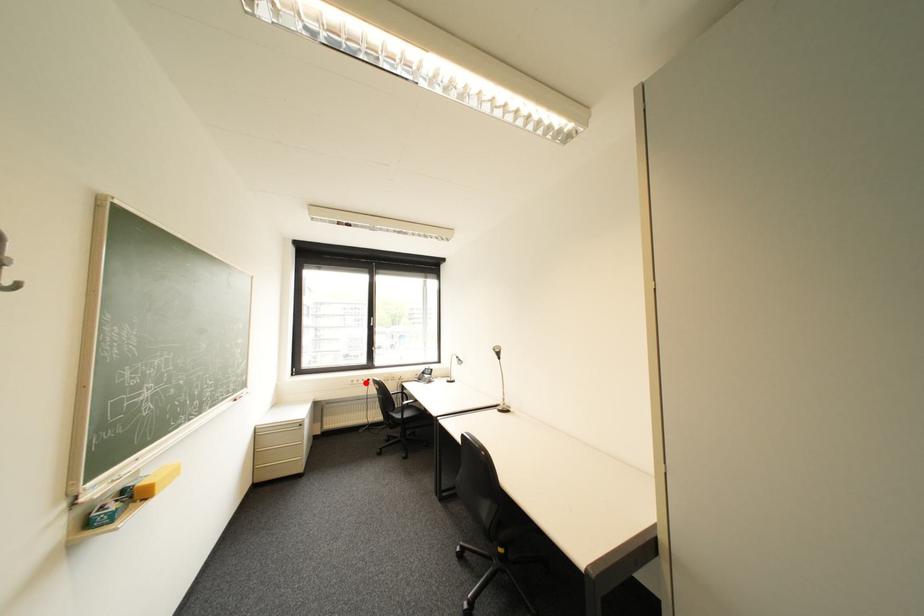
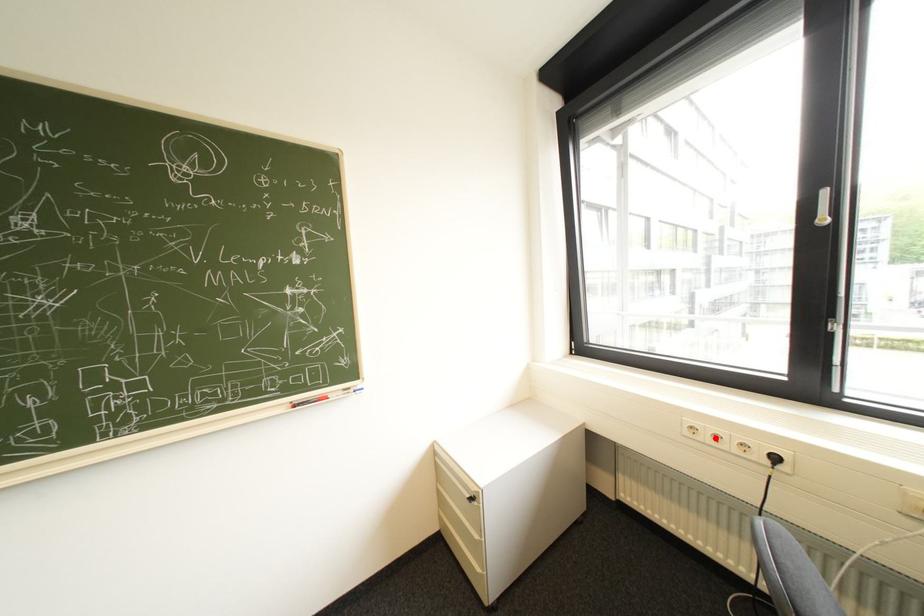
I am providing you with two images of the same scene from different viewpoints. A red point is marked on the first image and another point is marked on the second image. Does the point marked in image1 correspond to the same location as the one in image2?

Yes